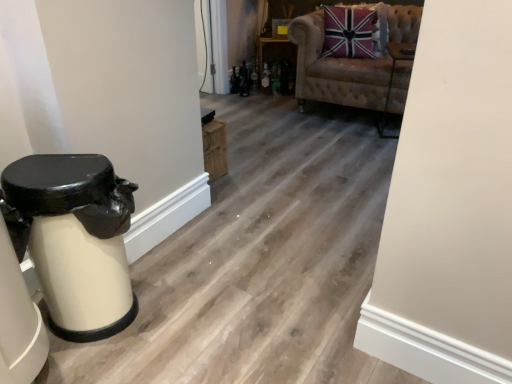
Question: Is the depth of white glossy trash can at left greater than that of wooden shelf at center?

Choices:
 (A) yes
 (B) no

Answer: (B)

Question: Is wooden shelf at center completely or partially inside white glossy trash can at left?

Choices:
 (A) no
 (B) yes

Answer: (A)

Question: Considering the relative positions of white glossy trash can at left and wooden shelf at center in the image provided, is white glossy trash can at left to the right of wooden shelf at center from the viewer's perspective?

Choices:
 (A) yes
 (B) no

Answer: (B)

Question: Is white glossy trash can at left positioned before wooden shelf at center?

Choices:
 (A) no
 (B) yes

Answer: (B)

Question: Is white glossy trash can at left bigger than wooden shelf at center?

Choices:
 (A) yes
 (B) no

Answer: (A)

Question: From the image's perspective, is white glossy trash can at left above wooden shelf at center?

Choices:
 (A) no
 (B) yes

Answer: (A)

Question: Is wooden shelf at center not near white glossy trash can at left?

Choices:
 (A) no
 (B) yes

Answer: (B)

Question: Considering the relative sizes of wooden shelf at center and white glossy trash can at left in the image provided, is wooden shelf at center thinner than white glossy trash can at left?

Choices:
 (A) yes
 (B) no

Answer: (B)

Question: From the image's perspective, is wooden shelf at center located beneath white glossy trash can at left?

Choices:
 (A) no
 (B) yes

Answer: (A)

Question: Considering the relative sizes of wooden shelf at center and white glossy trash can at left in the image provided, is wooden shelf at center shorter than white glossy trash can at left?

Choices:
 (A) no
 (B) yes

Answer: (B)

Question: Considering the relative positions of wooden shelf at center and white glossy trash can at left in the image provided, is wooden shelf at center to the right of white glossy trash can at left from the viewer's perspective?

Choices:
 (A) no
 (B) yes

Answer: (B)

Question: From a real-world perspective, does wooden shelf at center stand above white glossy trash can at left?

Choices:
 (A) no
 (B) yes

Answer: (A)

Question: From the image's perspective, is white glossy trash can at left beneath velvet union jack pillow at upper right?

Choices:
 (A) yes
 (B) no

Answer: (A)